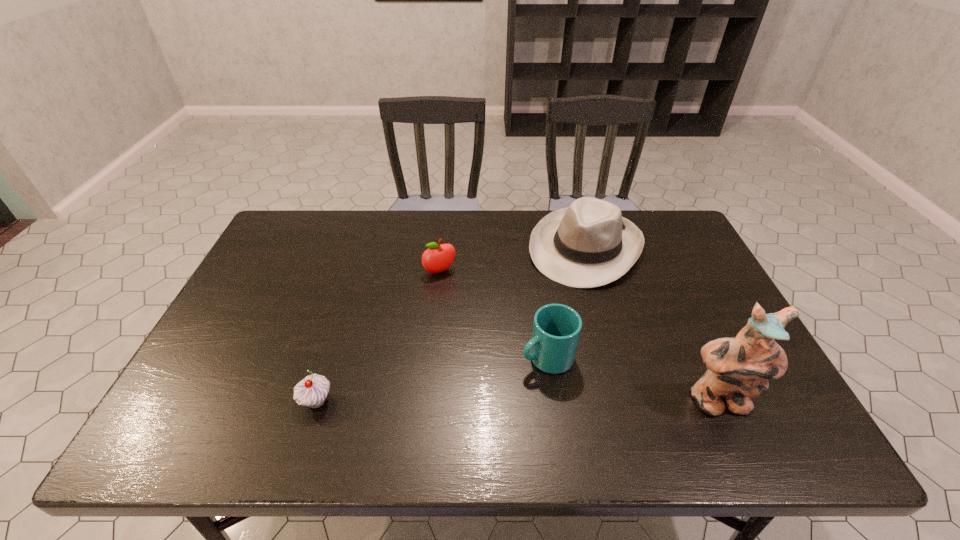
Locate an element on the screen. free space in the image that satisfies the following two spatial constraints: 1. on the front side of the cup; 2. on the left side of the apple is located at coordinates (431, 357).